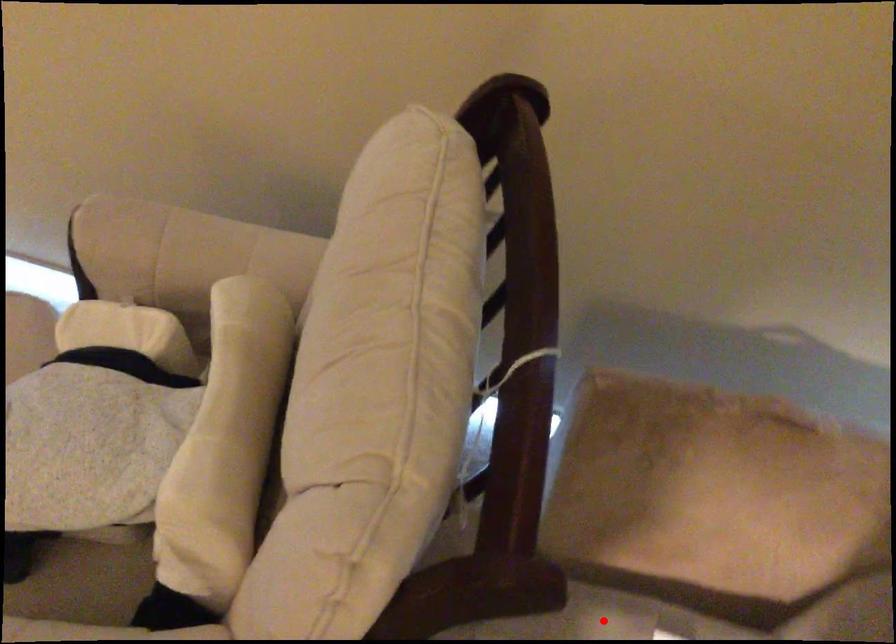
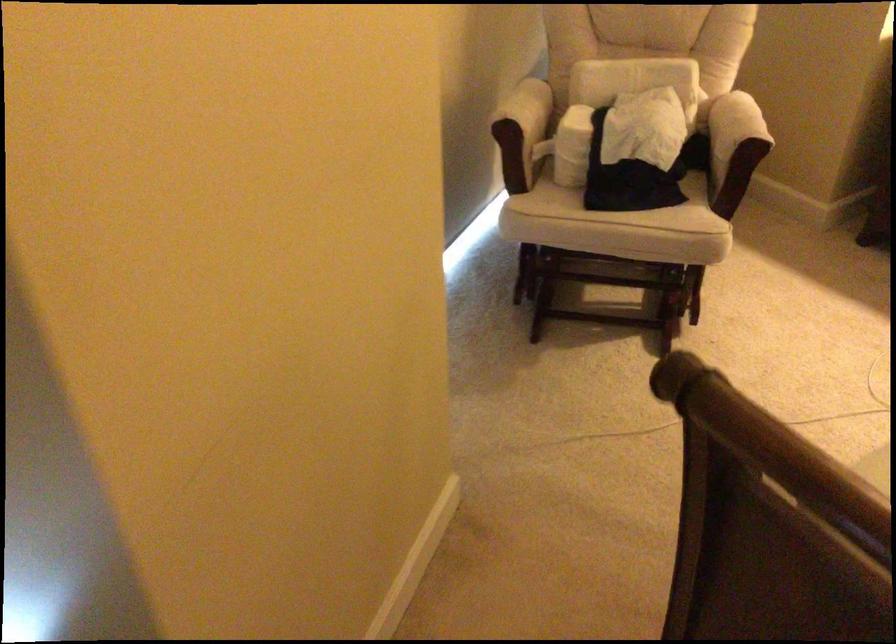
Question: I am providing you with two images of the same scene from different viewpoints. A red point is marked on the first image. Is the red point's position out of view in image 2?

Choices:
 (A) Yes
 (B) No

Answer: (A)